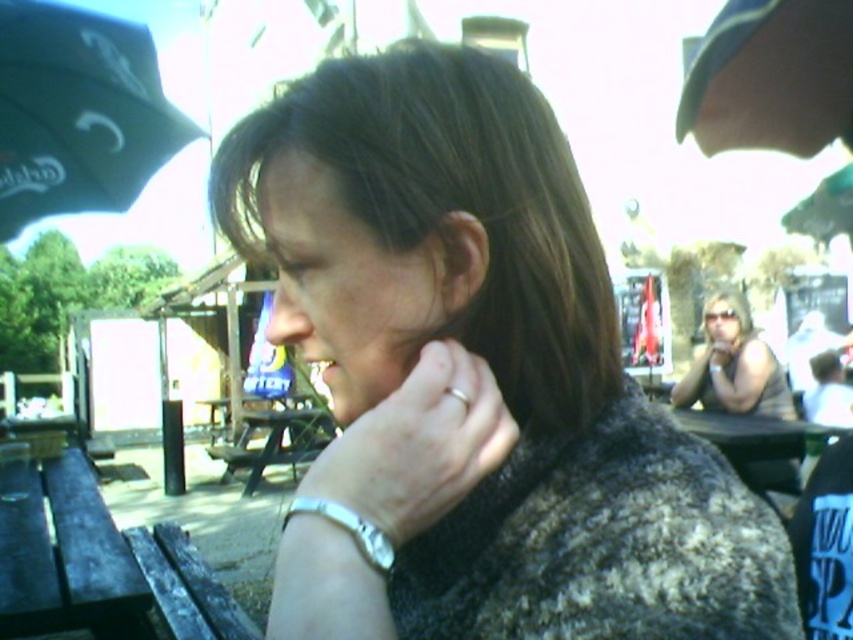
Question: Which point is farther to the camera?

Choices:
 (A) (306, 500)
 (B) (723, 326)
 (C) (163, 128)
 (D) (445, 518)

Answer: (B)

Question: Is dark brown hair at center to the right of black fabric umbrella at upper left from the viewer's perspective?

Choices:
 (A) no
 (B) yes

Answer: (B)

Question: Among these objects, which one is farthest from the camera?

Choices:
 (A) dark brown hair at center
 (B) black fabric umbrella at upper left

Answer: (B)

Question: Considering the relative positions of black fabric umbrella at upper left and silver metallic bracelet at lower center in the image provided, where is black fabric umbrella at upper left located with respect to silver metallic bracelet at lower center?

Choices:
 (A) right
 (B) left

Answer: (B)

Question: Which point appears farthest from the camera in this image?

Choices:
 (A) (780, 381)
 (B) (131, 93)

Answer: (A)

Question: Can you confirm if dark brown hair at center is smaller than silver metallic bracelet at lower center?

Choices:
 (A) yes
 (B) no

Answer: (A)